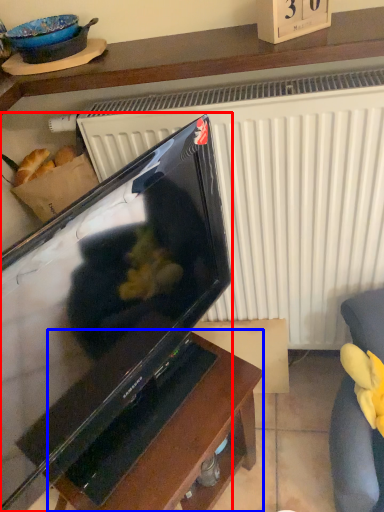
Question: Which of the following is the farthest to the observer, television (highlighted by a red box) or table (highlighted by a blue box)?

Choices:
 (A) television
 (B) table

Answer: (B)